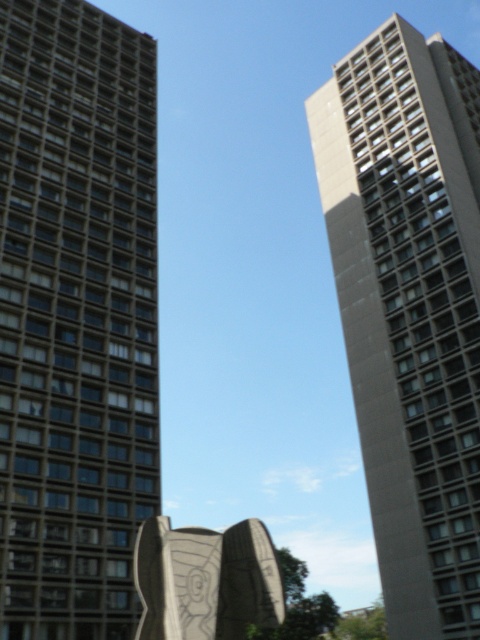
Question: Can you confirm if matte gray building at left is bigger than gray concrete building at right?

Choices:
 (A) no
 (B) yes

Answer: (A)

Question: Which of the following is the closest to the observer?

Choices:
 (A) (83, 637)
 (B) (450, 348)

Answer: (A)

Question: From the image, what is the correct spatial relationship of matte gray building at left in relation to gray concrete building at right?

Choices:
 (A) above
 (B) below

Answer: (A)

Question: Which point is closer to the camera taking this photo?

Choices:
 (A) (477, 396)
 (B) (14, 52)

Answer: (A)

Question: Can you confirm if matte gray building at left is bigger than gray concrete building at right?

Choices:
 (A) no
 (B) yes

Answer: (A)

Question: Among these objects, which one is farthest from the camera?

Choices:
 (A) matte gray building at left
 (B) gray concrete building at right

Answer: (B)